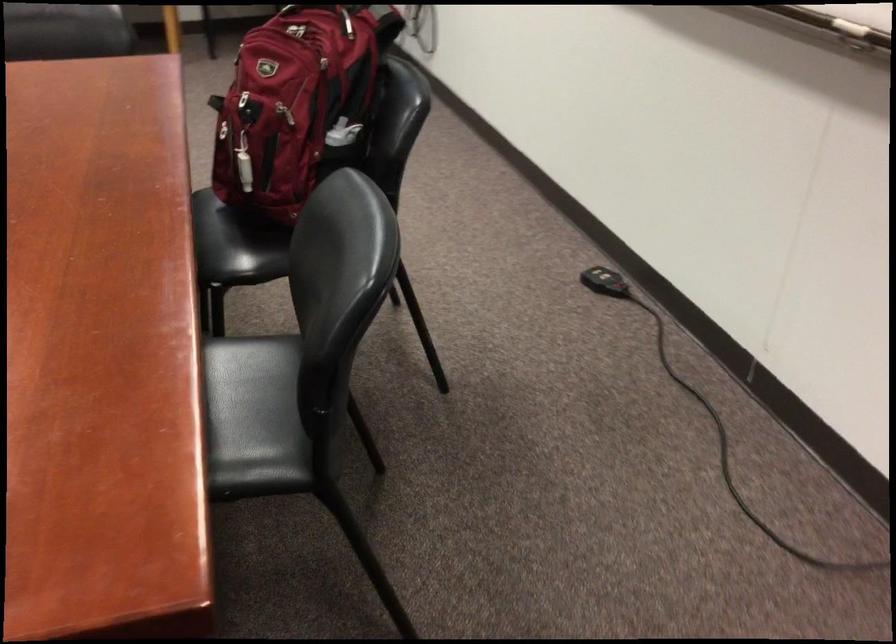
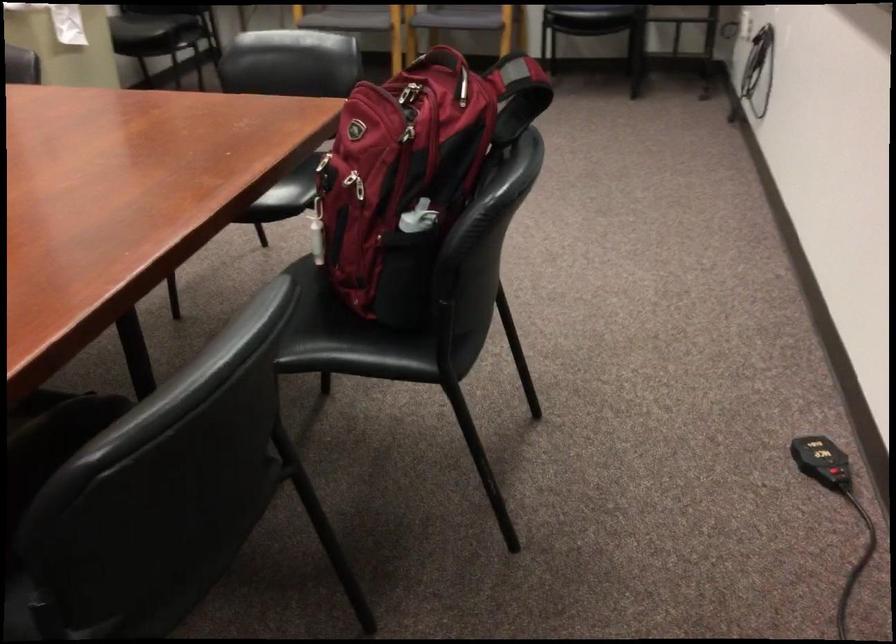
Locate, in the second image, the point that corresponds to point 197,100 in the first image.

(314, 153)